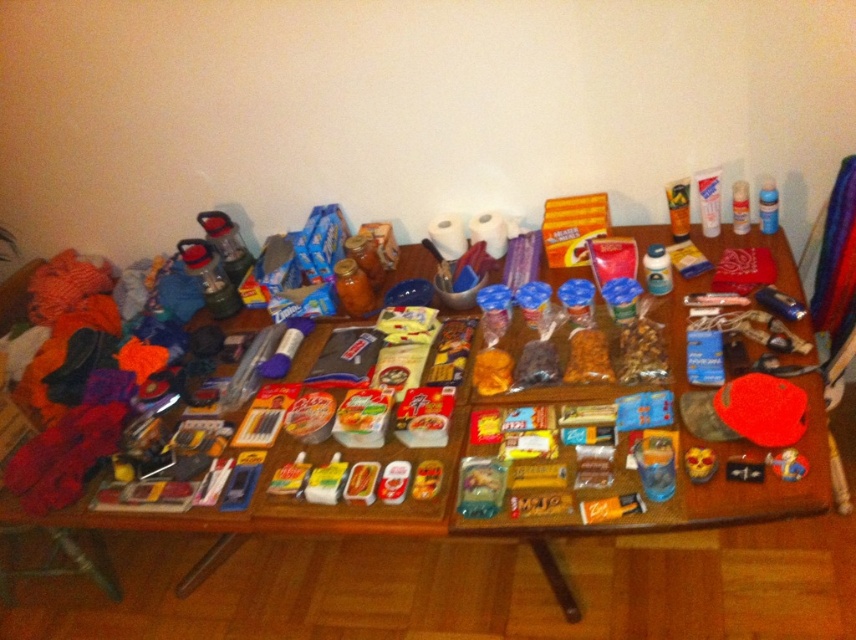
Question: Which object is the farthest from the yellow matte snack at center?

Choices:
 (A) yellow matte mask at center
 (B) brown crumbly snack at center
 (C) wooden table at center

Answer: (C)

Question: Is brown crumbly snack at center bigger than yellow matte snack at center?

Choices:
 (A) no
 (B) yes

Answer: (B)

Question: Estimate the real-world distances between objects in this image. Which object is closer to the yellow matte mask at center?

Choices:
 (A) brown crumbly snack at center
 (B) wooden table at center
 (C) yellow matte snack at center

Answer: (A)

Question: Does wooden table at center have a lesser width compared to brown crumbly snack at center?

Choices:
 (A) no
 (B) yes

Answer: (A)

Question: Is wooden table at center positioned before yellow matte mask at center?

Choices:
 (A) no
 (B) yes

Answer: (A)

Question: Among these points, which one is farthest from the camera?

Choices:
 (A) (696, 474)
 (B) (324, 611)

Answer: (B)